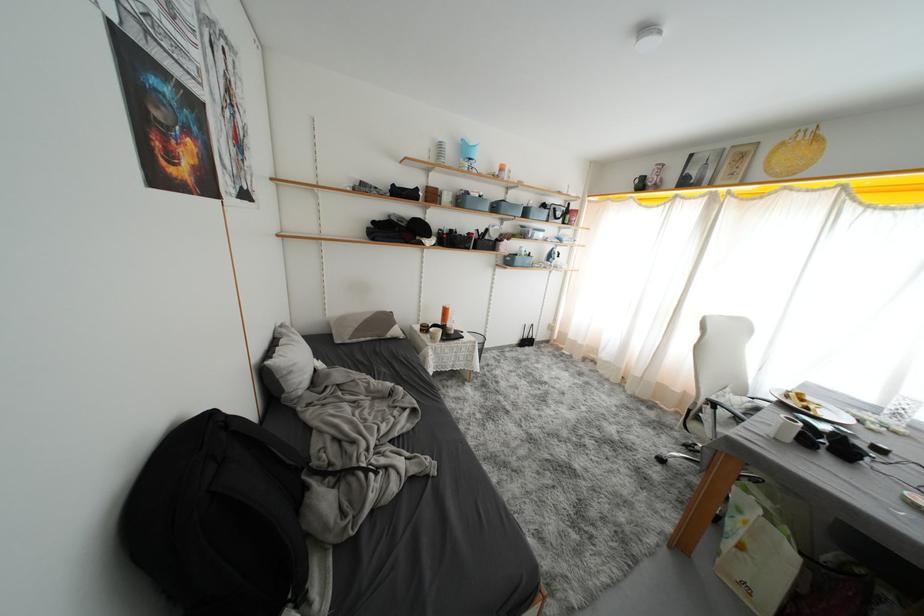
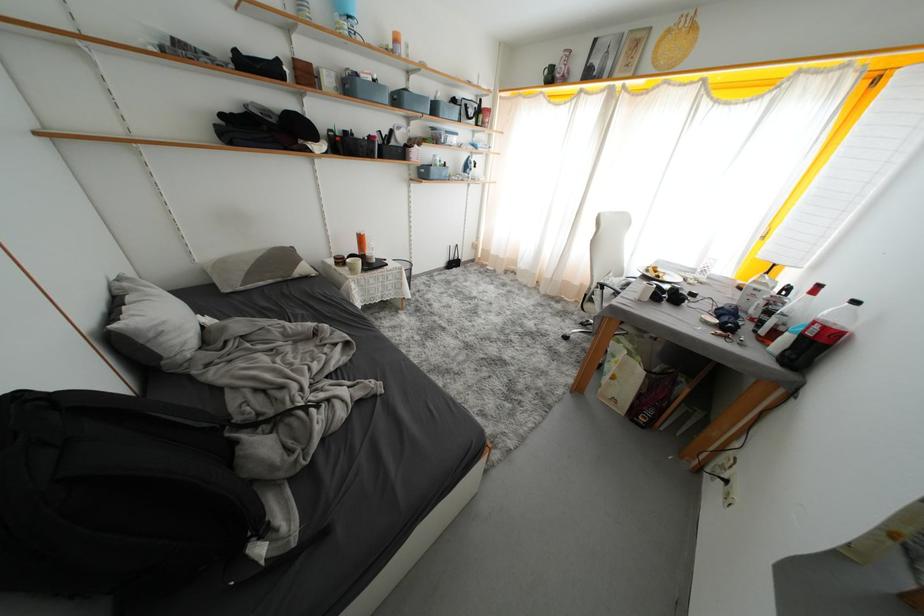
Where in the second image is the point corresponding to pixel 493 233 from the first image?

(397, 136)